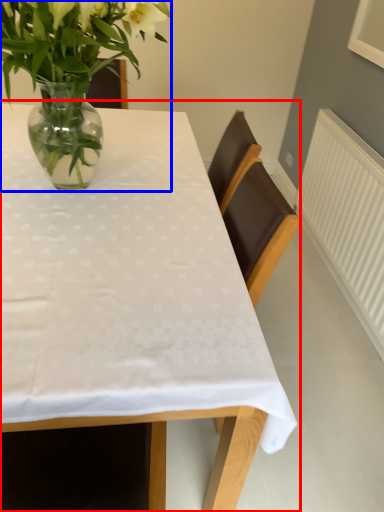
Question: Among these objects, which one is nearest to the camera, table (highlighted by a red box) or houseplant (highlighted by a blue box)?

Choices:
 (A) table
 (B) houseplant

Answer: (A)